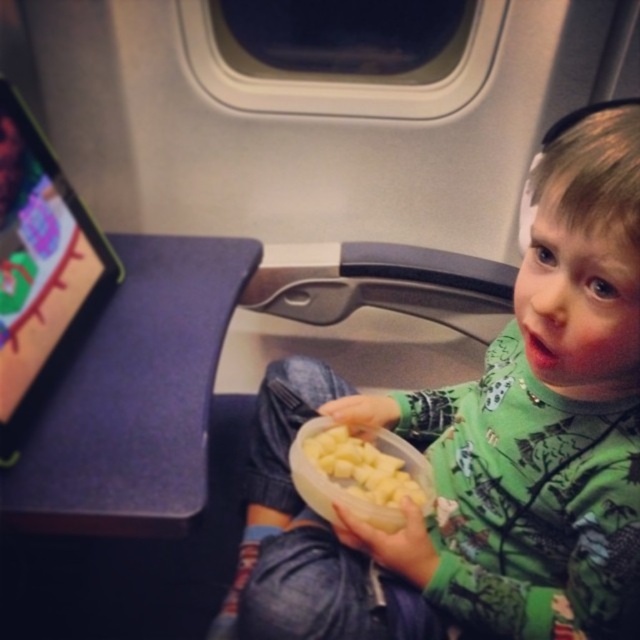
Can you confirm if green matte shirt at center is taller than yellow matte potato at center?

Yes, green matte shirt at center is taller than yellow matte potato at center.

Who is more forward, (397, 548) or (344, 456)?

Point (397, 548) is in front.

The width and height of the screenshot is (640, 640). I want to click on green matte shirt at center, so click(484, 445).